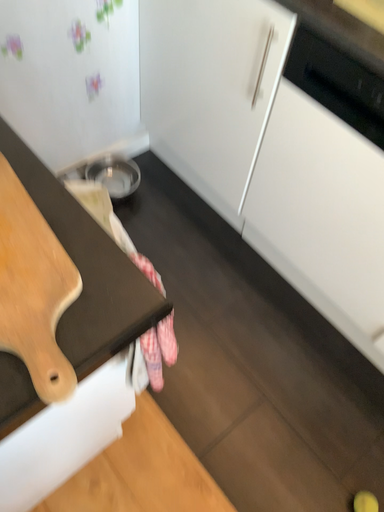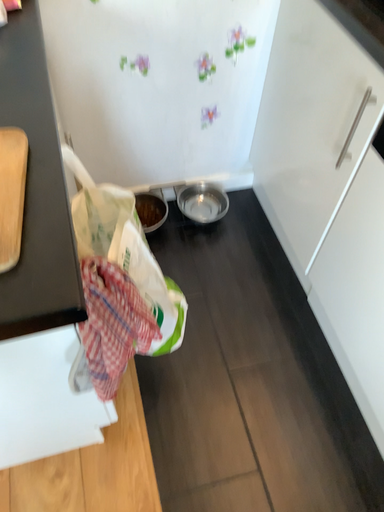
Question: Which way did the camera rotate in the video?

Choices:
 (A) rotated right
 (B) rotated left

Answer: (B)